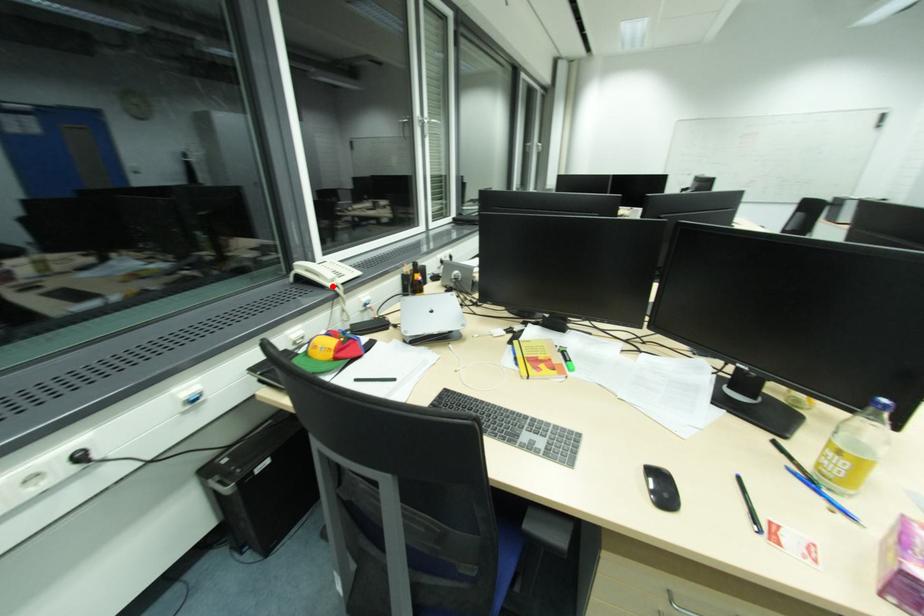
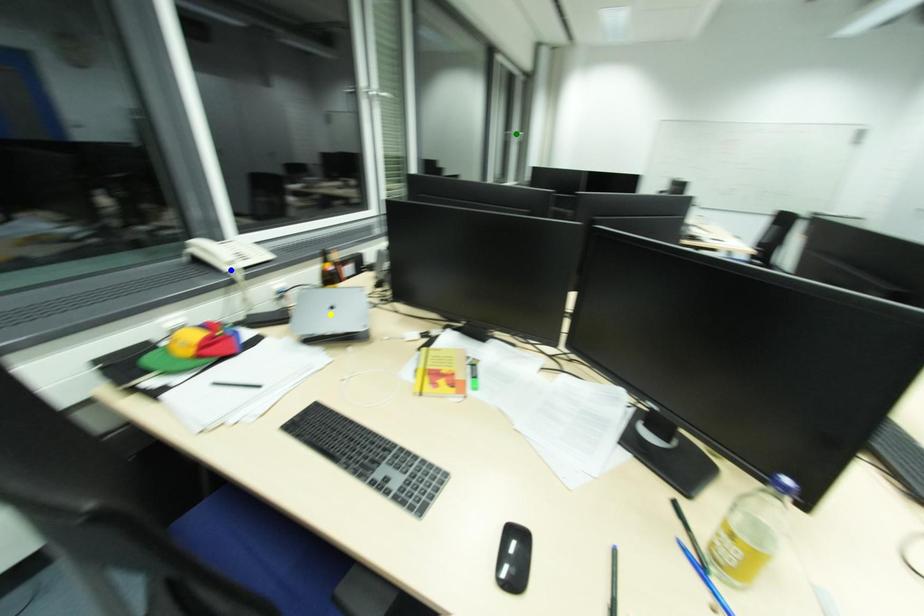
Question: I am providing you with two images of the same scene from different viewpoints. A red point is marked on the first image. You are given multiple points on the second image. Can you choose the point in image 2 that corresponds to the point in image 1?

Choices:
 (A) yellow point
 (B) blue point
 (C) green point

Answer: (B)